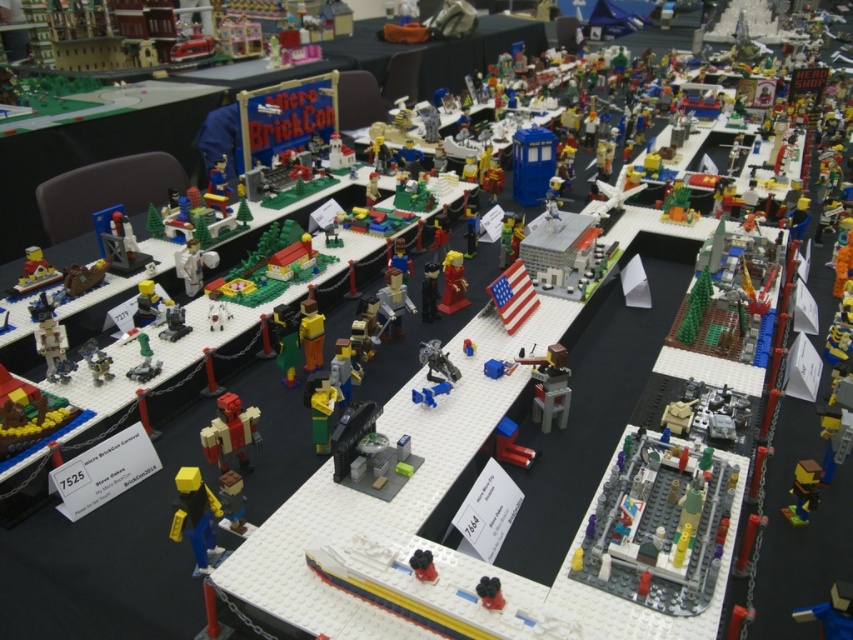
Which is above, yellow plastic figure at center or blue plastic toy at lower right?

yellow plastic figure at center is higher up.

The height and width of the screenshot is (640, 853). What do you see at coordinates (195, 516) in the screenshot?
I see `yellow plastic figure at center` at bounding box center [195, 516].

The width and height of the screenshot is (853, 640). I want to click on yellow plastic figure at center, so click(195, 516).

Which is more to the left, yellow plastic figure at center or brick-like red robot at center?

yellow plastic figure at center

Who is more forward, (189,524) or (241,449)?

Point (189,524) is more forward.

At what (x,y) coordinates should I click in order to perform the action: click on yellow plastic figure at center. Please return your answer as a coordinate pair (x, y). The height and width of the screenshot is (640, 853). Looking at the image, I should click on (195, 516).

Is brick-like red robot at center positioned behind blue plastic toy at lower right?

Yes.

Is brick-like red robot at center thinner than blue plastic toy at lower right?

In fact, brick-like red robot at center might be wider than blue plastic toy at lower right.

This screenshot has height=640, width=853. I want to click on brick-like red robot at center, so click(230, 433).